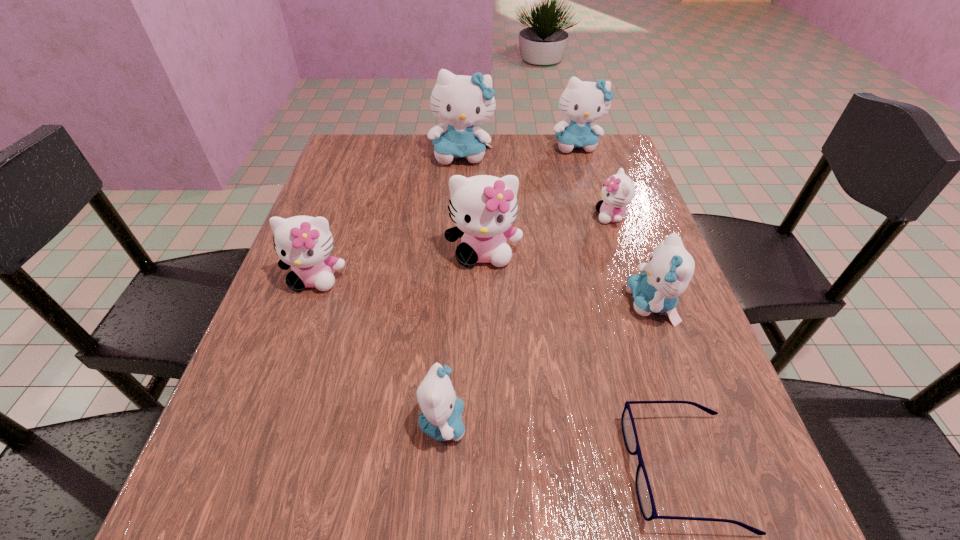
You are a GUI agent. You are given a task and a screenshot of the screen. Output one action in this format:
    pyautogui.click(x=<x>, y=<y>)
    Task: Click on the smallest blue kitten
    The width and height of the screenshot is (960, 540).
    Given the screenshot: What is the action you would take?
    pyautogui.click(x=441, y=418)

This screenshot has width=960, height=540. In order to click on the shortest object in this screenshot , I will do `click(644, 493)`.

Locate an element on the screen. vacant region located on the face of the tallest kitten is located at coordinates coord(456,274).

Find the location of a particular element. blank space located 0.200m on the face of the third smallest blue kitten is located at coordinates (592, 199).

In order to click on blank space located on the front-facing side of the biggest white kitten in this screenshot , I will do `click(484, 313)`.

The height and width of the screenshot is (540, 960). Find the location of `free region located on the face of the third farthest blue kitten`. free region located on the face of the third farthest blue kitten is located at coordinates (464, 304).

The height and width of the screenshot is (540, 960). I want to click on free location located on the face of the third farthest blue kitten, so click(x=515, y=304).

Find the location of `vacant region located 0.320m on the face of the third farthest blue kitten`. vacant region located 0.320m on the face of the third farthest blue kitten is located at coordinates (464, 304).

Where is `vacant space located on the front-facing side of the leftmost kitten`? The width and height of the screenshot is (960, 540). vacant space located on the front-facing side of the leftmost kitten is located at coordinates (290, 350).

At what (x,y) coordinates should I click in order to perform the action: click on vacant region located 0.400m on the front-facing side of the third farthest object. Please return your answer as a coordinate pair (x, y). The height and width of the screenshot is (540, 960). Looking at the image, I should click on [x=428, y=217].